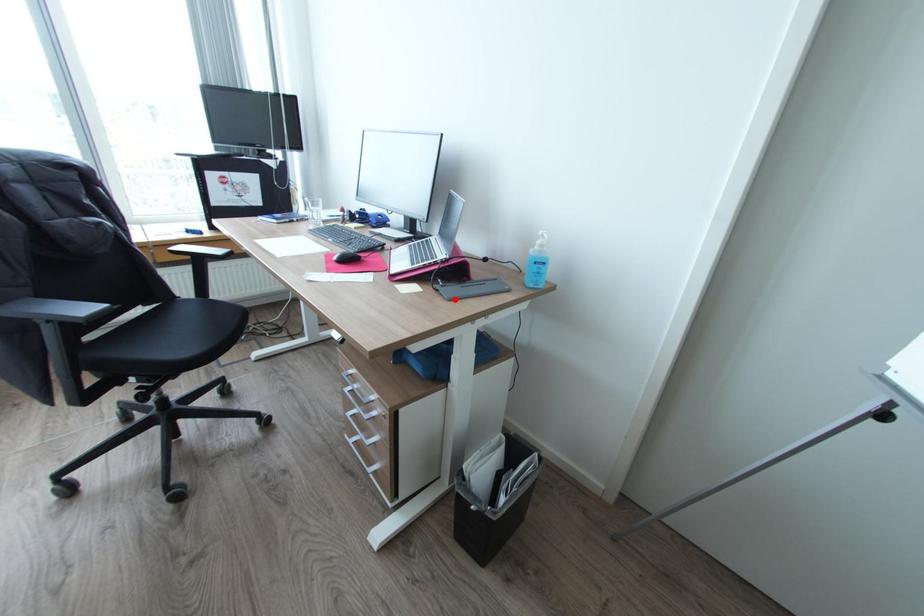
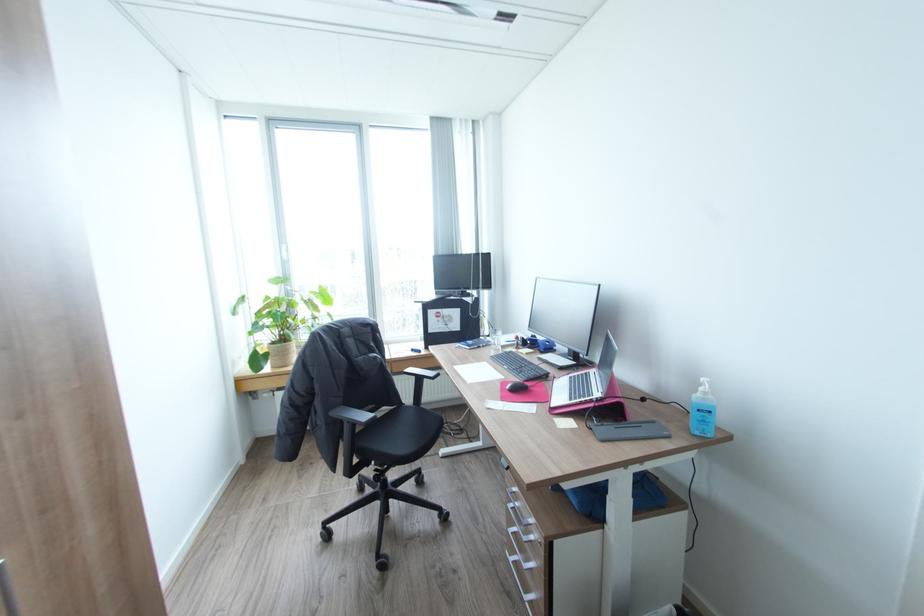
The point at the highlighted location is marked in the first image. Where is the corresponding point in the second image?

(608, 440)